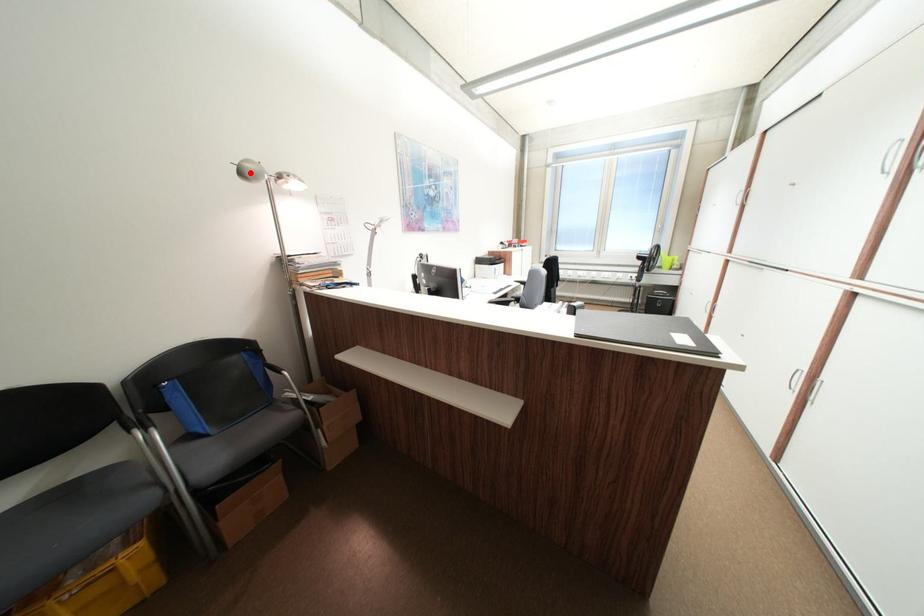
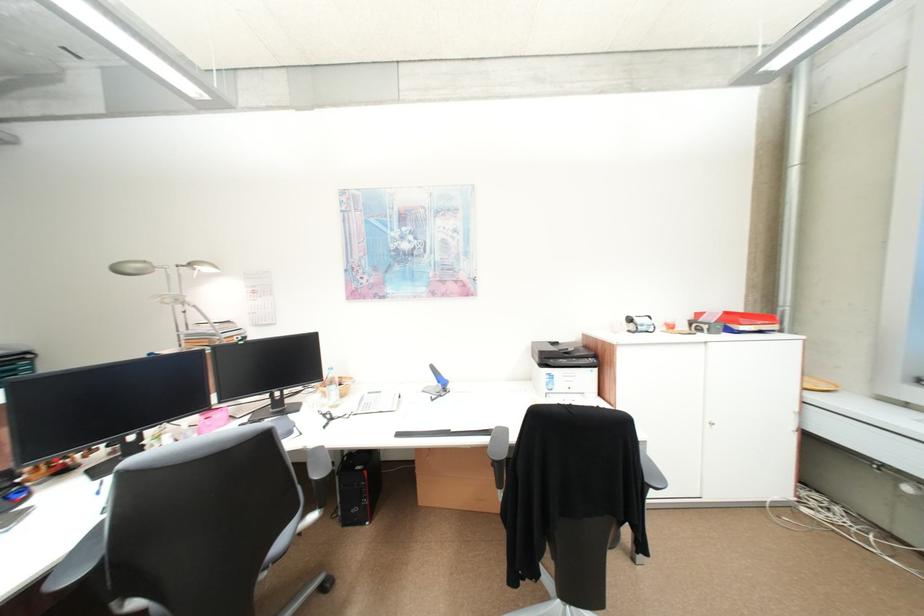
Locate, in the second image, the point that corresponds to the highlighted location in the first image.

(127, 272)